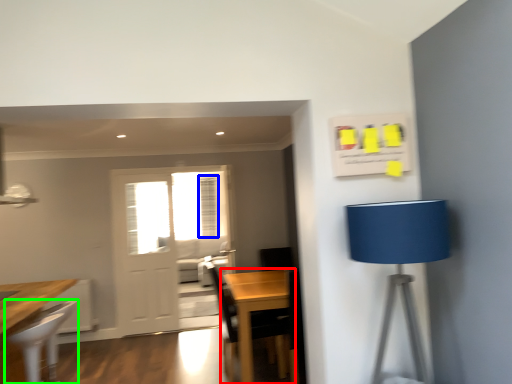
Question: Based on their relative distances, which object is nearer to table (highlighted by a red box)? Choose from curtain (highlighted by a blue box) and chair (highlighted by a green box).

Choices:
 (A) curtain
 (B) chair

Answer: (B)